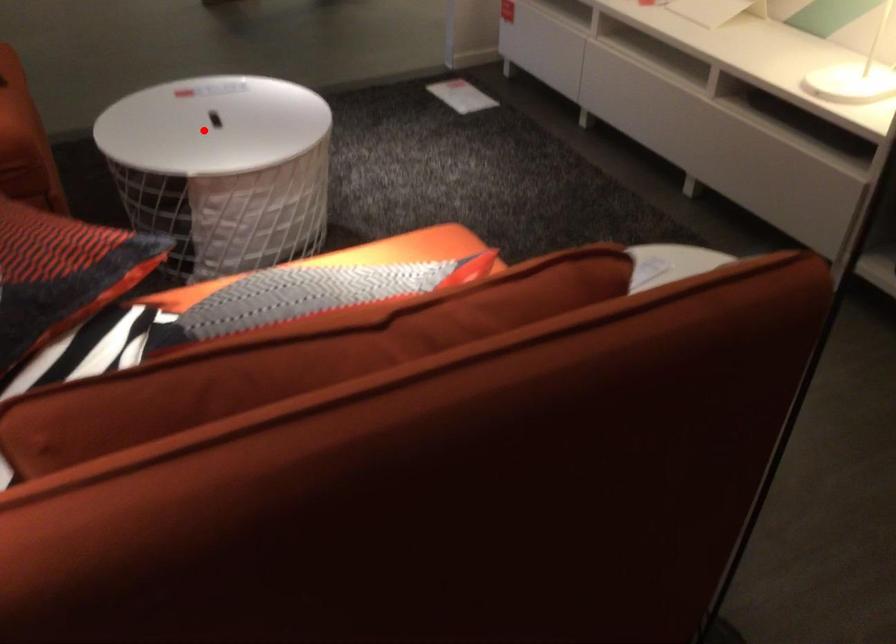
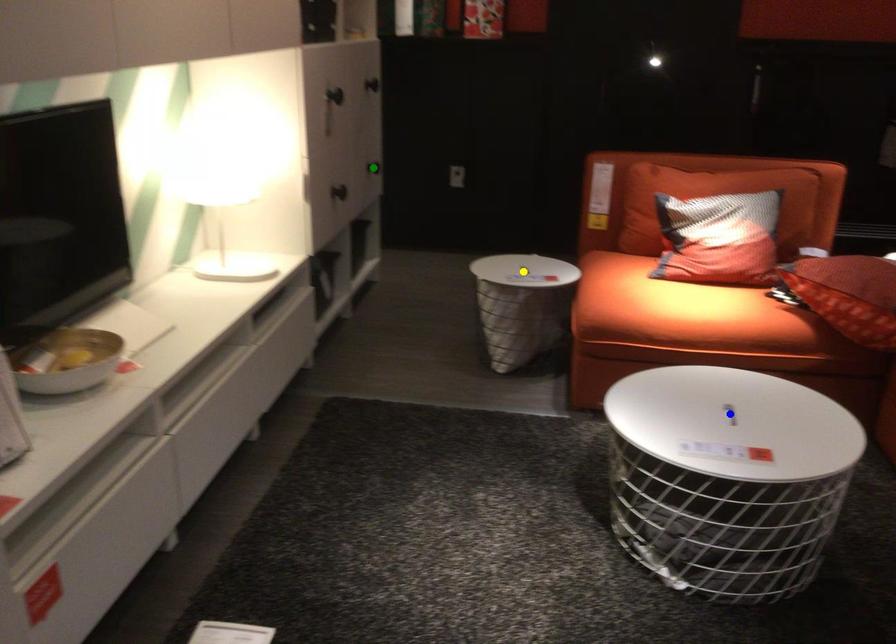
Question: I am providing you with two images of the same scene from different viewpoints. A red point is marked on the first image. You are given multiple points on the second image. Which mark in image 2 goes with the point in image 1?

Choices:
 (A) green point
 (B) blue point
 (C) yellow point

Answer: (B)